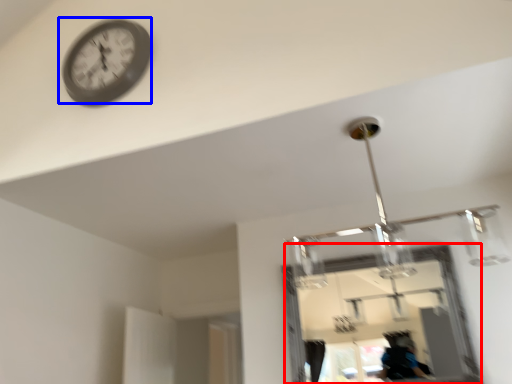
Question: Which object is further to the camera taking this photo, mirror (highlighted by a red box) or wall clock (highlighted by a blue box)?

Choices:
 (A) mirror
 (B) wall clock

Answer: (A)